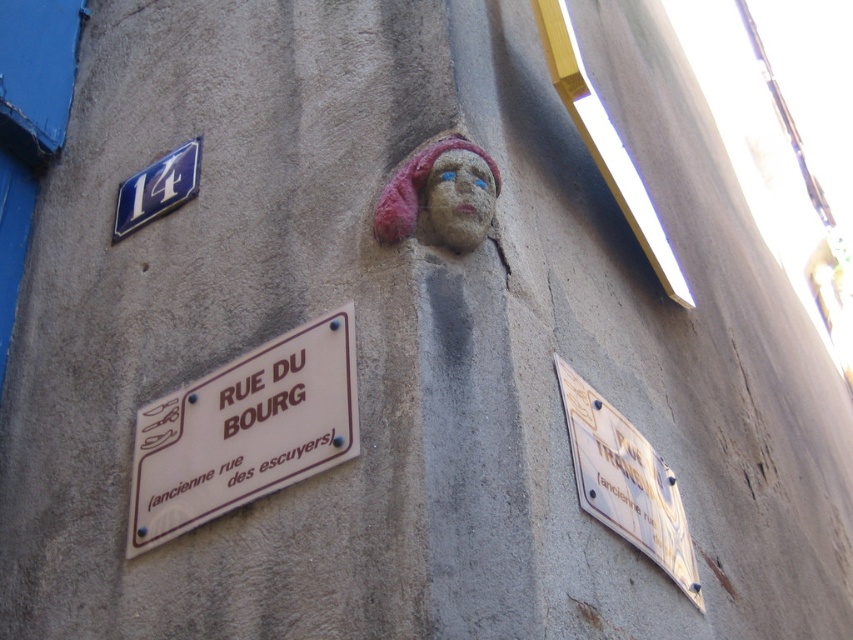
You are standing in front of a historic building and want to take a photo of the plaque with the French text and the carved stone face. If you are exactly 1.55 meters away from the point marked at coordinates point (x=659, y=468), will you be able to capture both the plaque and the carved stone face in the same frame without moving closer or farther?

Since you are exactly 1.55 meters away from the point (x=659, y=468), which is the distance specified in the description, you can capture both the plaque and the carved stone face in the same frame without needing to adjust your distance.

You are a painter who needs to hang a new sign that is 15 cm tall. You see the stone face at upper center and the blue metallic sign at upper left. Which object can accommodate the new sign without overlapping, considering their heights?

The blue metallic sign at upper left has a greater height than the stone face at upper center, so the new 15 cm tall sign can be placed near the blue metallic sign at upper left without overlapping.

You are a tourist in Paris and want to take a photo of the blue metallic sign at upper left and the stone face at upper center. To ensure both are in the frame, where should you position your camera relative to the wall?

Position your camera to the left side of the wall so that the blue metallic sign at upper left is on the right and the stone face at upper center is on the left within the frame.